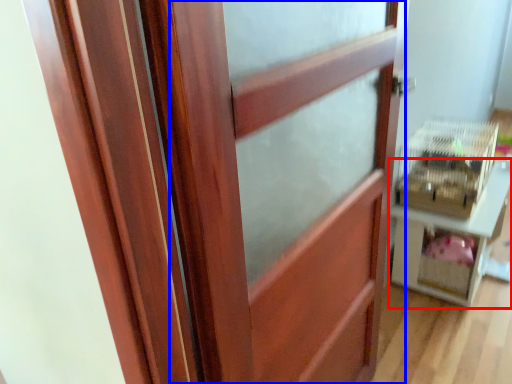
Question: Which object appears closest to the camera in this image, furniture (highlighted by a red box) or barn door (highlighted by a blue box)?

Choices:
 (A) furniture
 (B) barn door

Answer: (B)